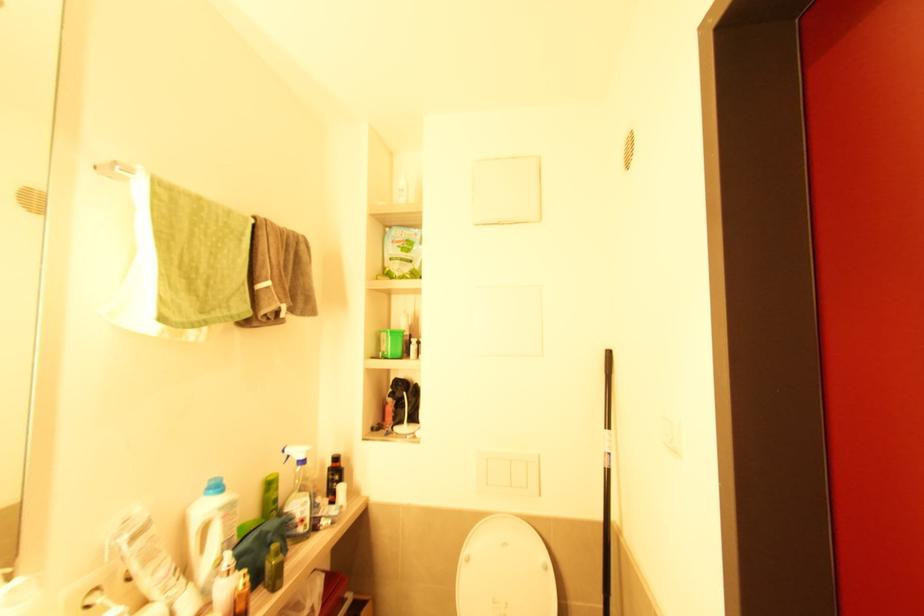
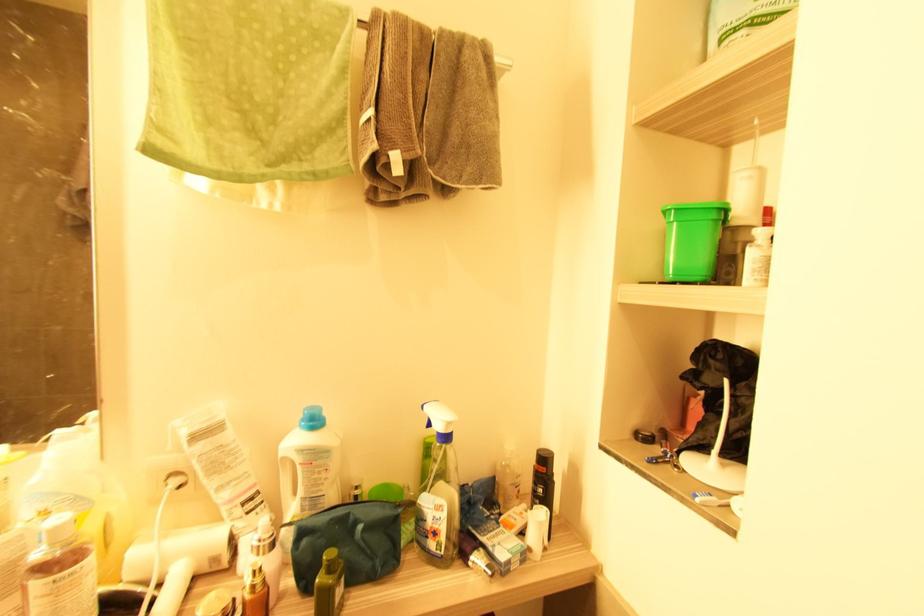
Find the pixel in the second image that matches [271,537] in the first image.

(361, 529)